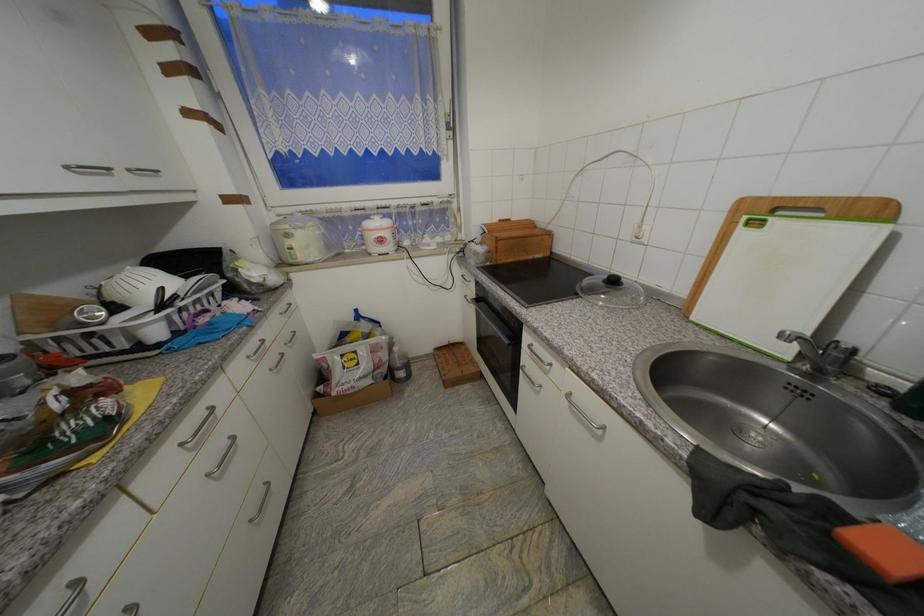
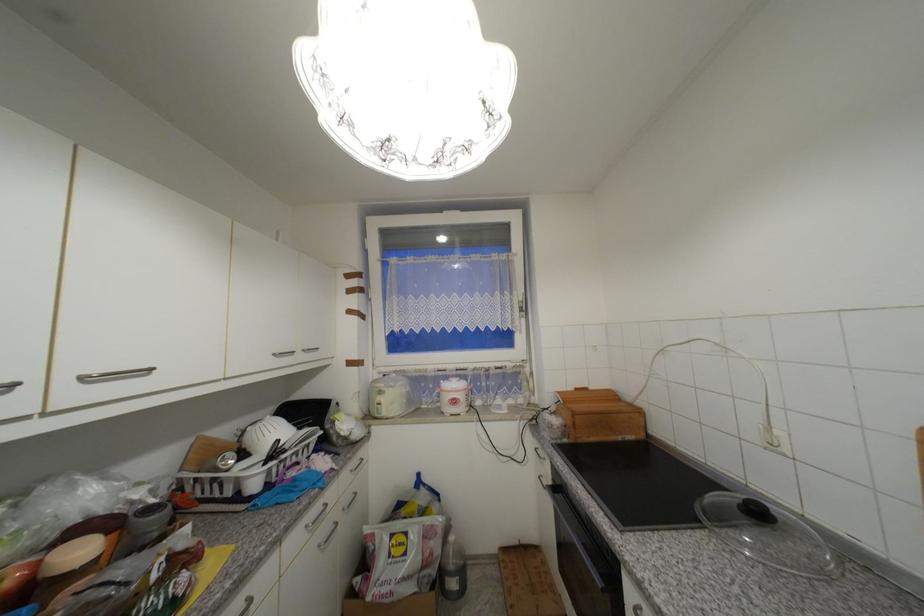
In the second image, find the point that corresponds to point 445,100 in the first image.

(520, 294)